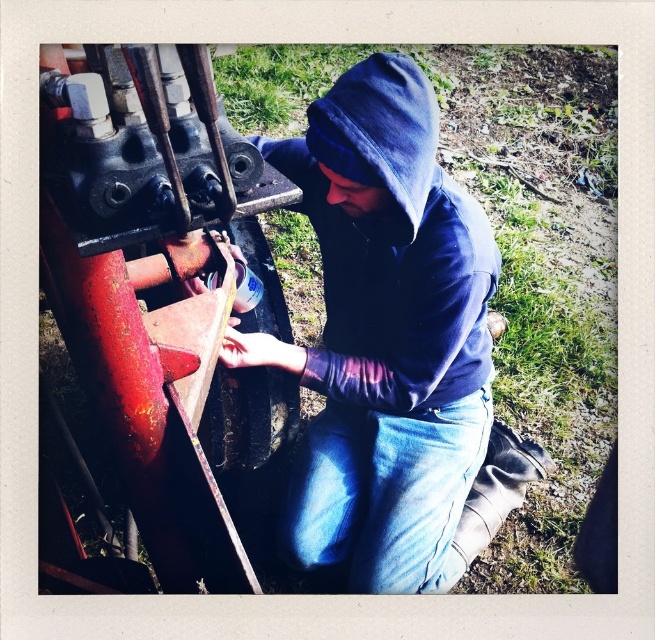
Describe the element at coordinates (388, 497) in the screenshot. Image resolution: width=655 pixels, height=640 pixels. I see `denim at center` at that location.

Which is in front, point (396, 428) or point (350, 163)?

Point (350, 163) is in front.

The image size is (655, 640). What do you see at coordinates (388, 497) in the screenshot?
I see `denim at center` at bounding box center [388, 497].

Where is `denim at center`? This screenshot has height=640, width=655. denim at center is located at coordinates (x=388, y=497).